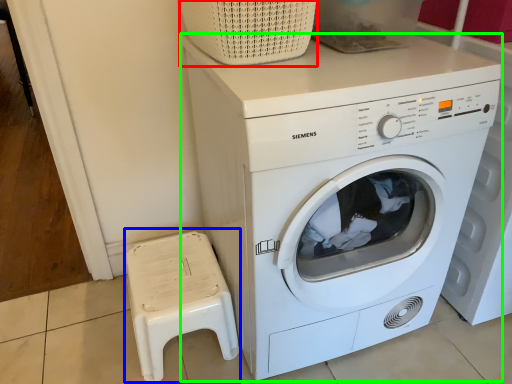
Question: Estimate the real-world distances between objects in this image. Which object is closer to basket (highlighted by a red box), music stool (highlighted by a blue box) or washing machine (highlighted by a green box)?

Choices:
 (A) music stool
 (B) washing machine

Answer: (B)